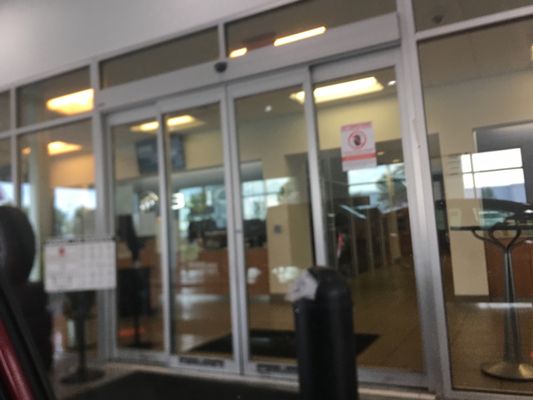
This screenshot has width=533, height=400. In order to click on walls in this screenshot , I will do `click(282, 135)`, `click(472, 109)`.